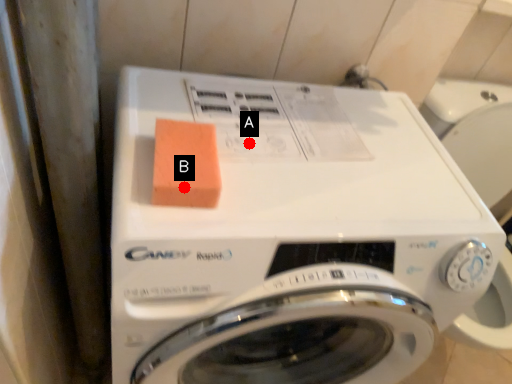
Question: Two points are circled on the image, labeled by A and B beside each circle. Which point is closer to the camera?

Choices:
 (A) A is closer
 (B) B is closer

Answer: (B)